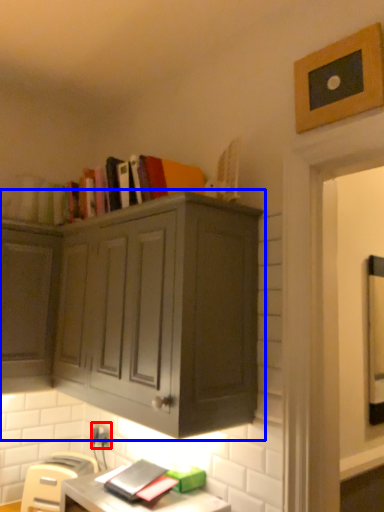
Question: Which object appears farthest to the camera in this image, electric outlet (highlighted by a red box) or cabinetry (highlighted by a blue box)?

Choices:
 (A) electric outlet
 (B) cabinetry

Answer: (A)